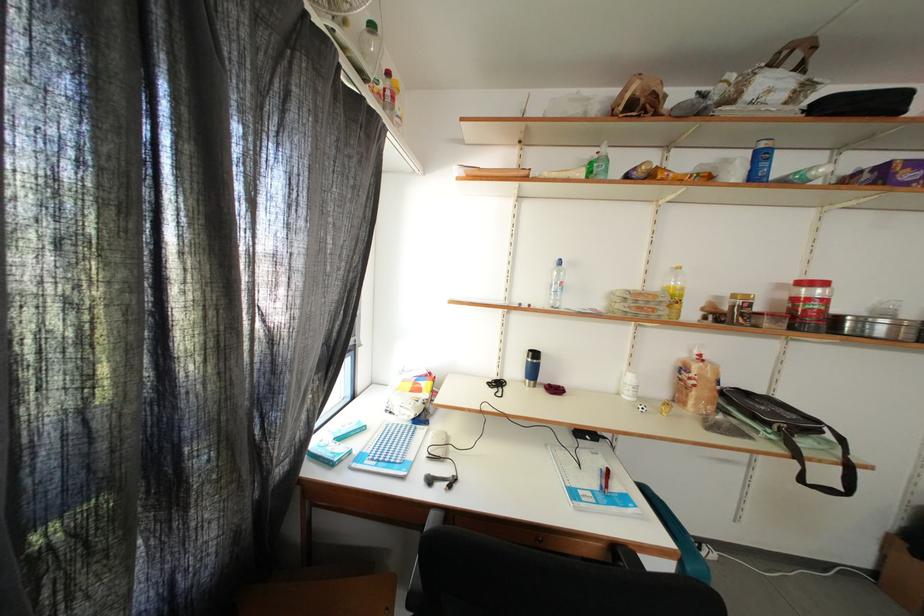
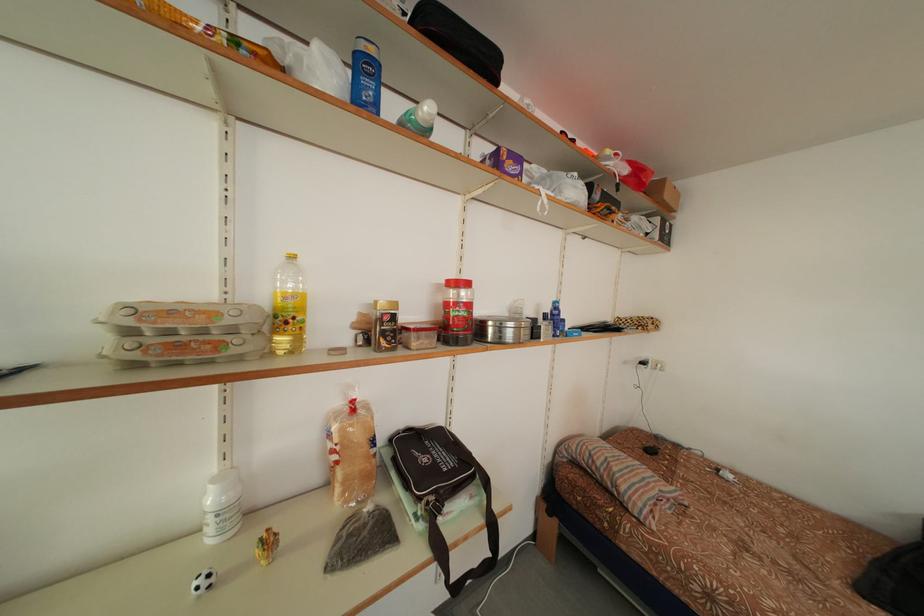
Find the pixel in the second image that matches point (857, 330) in the first image.

(499, 334)